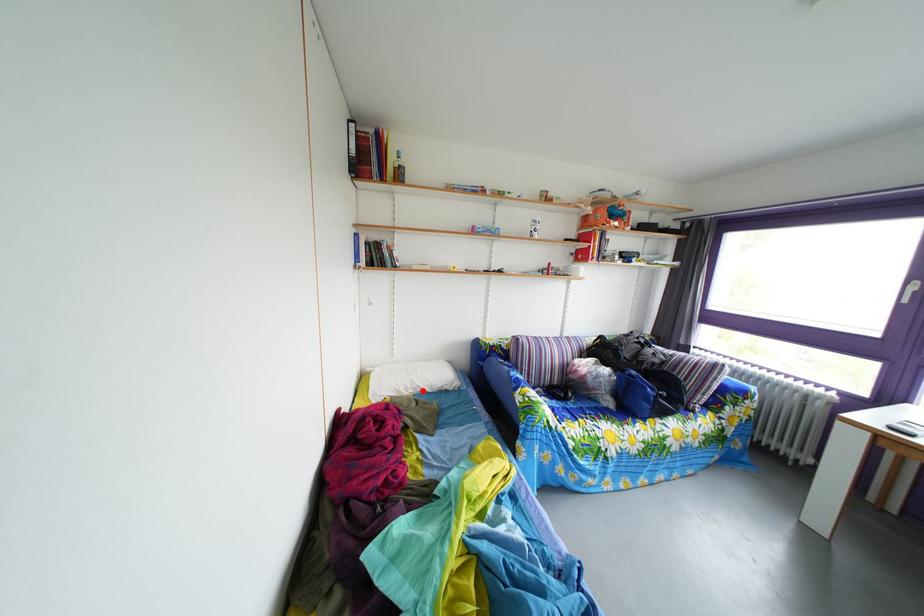
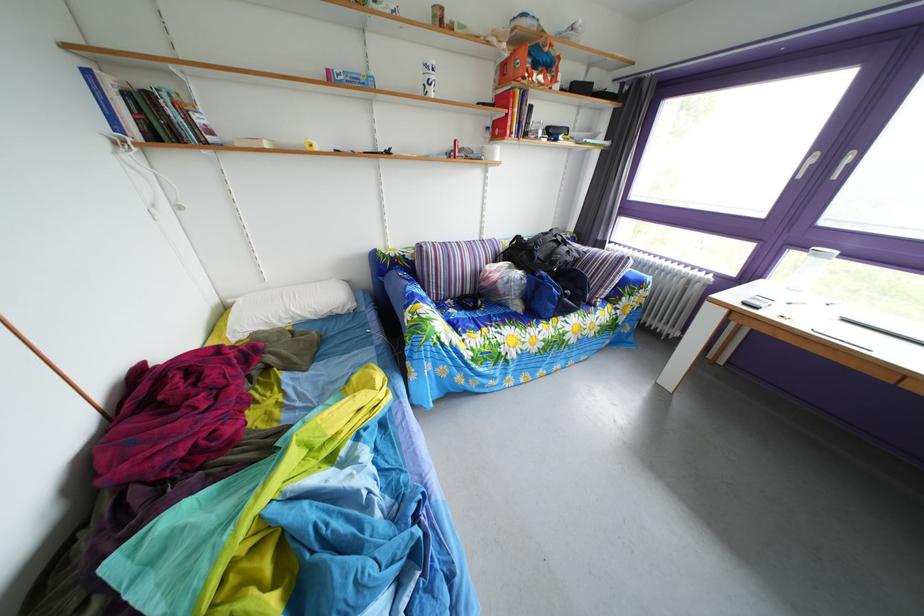
Find the pixel in the second image that matches the highlighted location in the first image.

(298, 320)